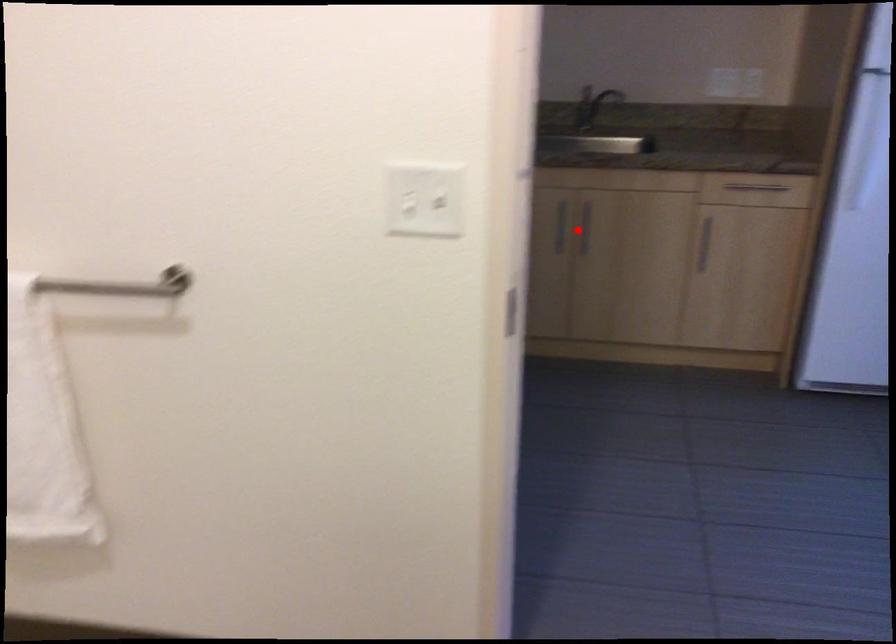
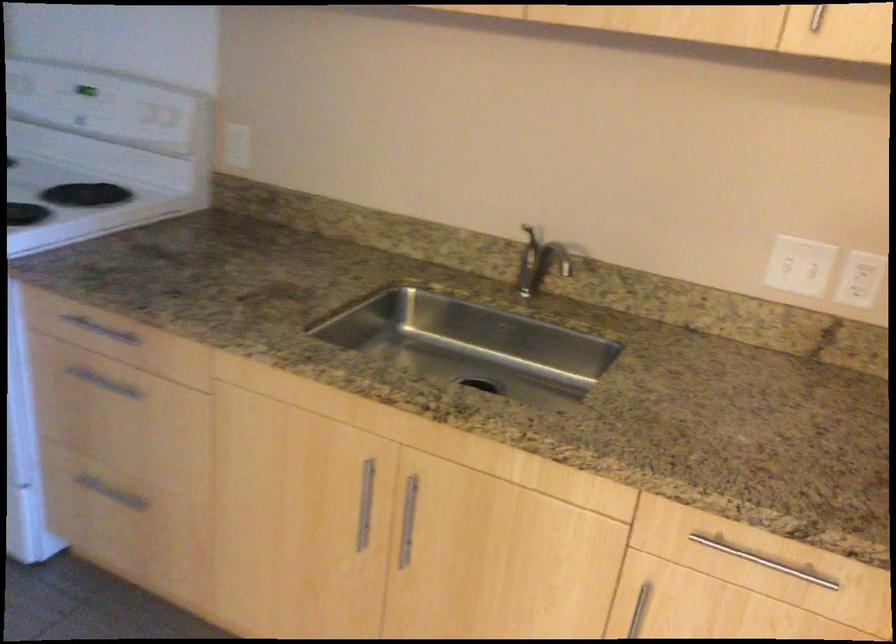
Question: A red point is marked in image1. In image2, is the corresponding 3D point closer to the camera or farther? Reply with the corresponding letter.

Choices:
 (A) The corresponding 3D point is closer.
 (B) The corresponding 3D point is farther.

Answer: (A)